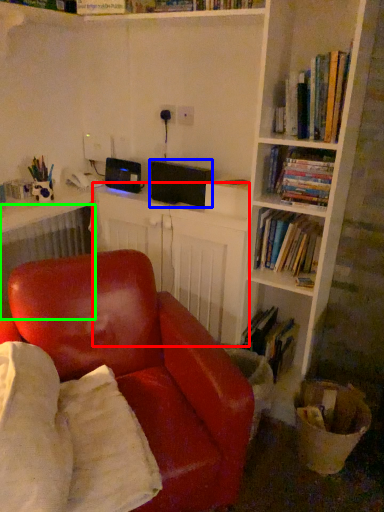
Question: Which object is positioned farthest from computer desk (highlighted by a red box)? Select from speaker (highlighted by a blue box) and radiator (highlighted by a green box).

Choices:
 (A) speaker
 (B) radiator

Answer: (B)